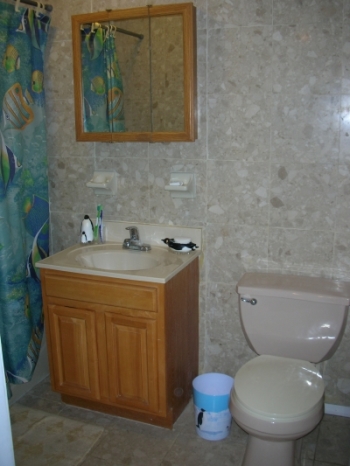
Locate an element on the screen. The width and height of the screenshot is (350, 466). toilet tank is located at coordinates click(295, 329).